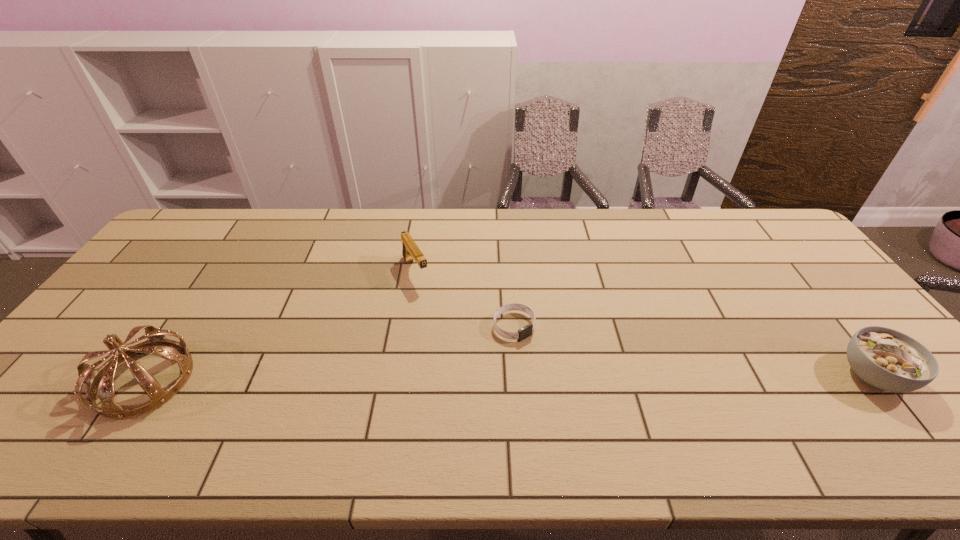
Image resolution: width=960 pixels, height=540 pixels. In order to click on vacant space located 0.370m at the barrel of the pistol in this screenshot , I will do `click(478, 377)`.

In order to click on blank area located at the barrel of the pistol in this screenshot , I will do `click(453, 339)`.

Image resolution: width=960 pixels, height=540 pixels. What are the coordinates of `vacant space located 0.100m on the outer surface of the shortest object` in the screenshot? It's located at point(552,364).

This screenshot has height=540, width=960. I want to click on free space located 0.210m on the outer surface of the shortest object, so click(582, 396).

I want to click on vacant space located 0.120m on the outer surface of the shortest object, so click(557, 370).

Where is `tiara at the near edge`? The image size is (960, 540). tiara at the near edge is located at coordinates (101, 381).

This screenshot has width=960, height=540. I want to click on soup bowl at the near edge, so click(884, 358).

Locate an element on the screen. The image size is (960, 540). object positioned at the left edge is located at coordinates coord(101,381).

The height and width of the screenshot is (540, 960). I want to click on object positioned at the right edge, so [x=884, y=358].

The width and height of the screenshot is (960, 540). What are the coordinates of `object that is at the near left corner` in the screenshot? It's located at (101, 381).